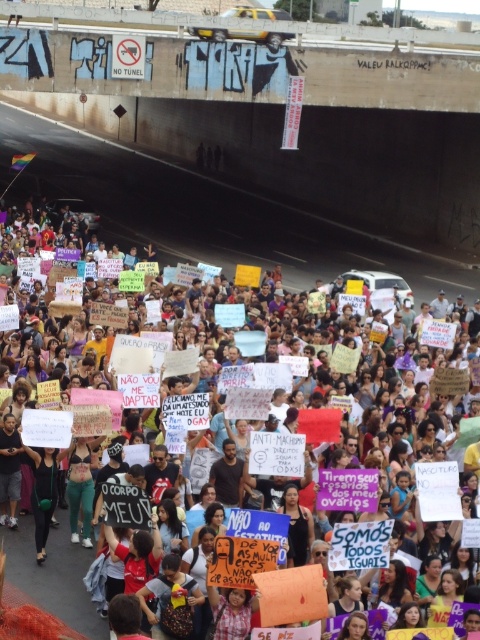
Which of these two, brown concrete highway at upper center or white paper sign at center, stands taller?

Standing taller between the two is brown concrete highway at upper center.

Can you confirm if brown concrete highway at upper center is thinner than white paper sign at center?

No.

Image resolution: width=480 pixels, height=640 pixels. What are the coordinates of `brown concrete highway at upper center` in the screenshot? It's located at pyautogui.click(x=252, y=200).

This screenshot has width=480, height=640. Identify the location of brown concrete highway at upper center. (252, 200).